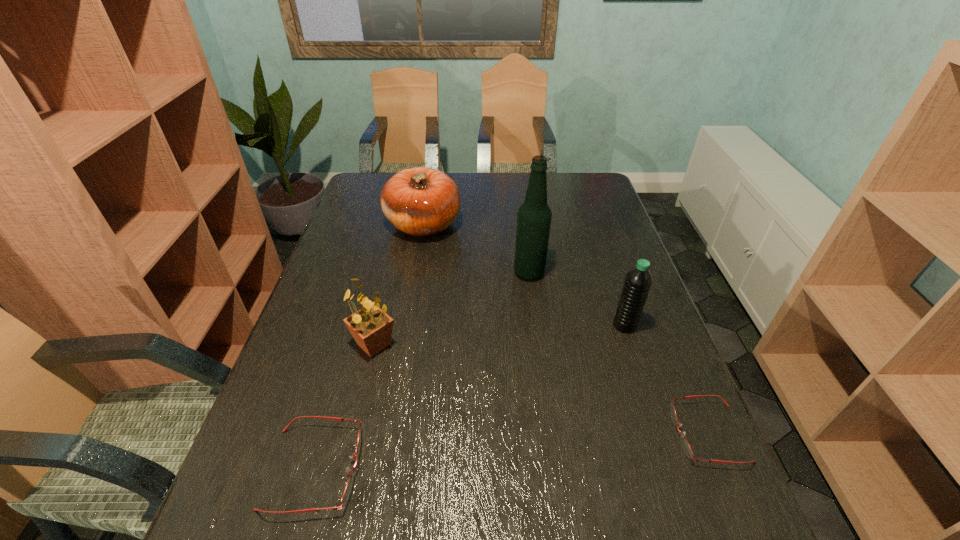
This screenshot has width=960, height=540. Find the location of `free location located 0.380m on the lenses of the right spectacles`. free location located 0.380m on the lenses of the right spectacles is located at coordinates (490, 434).

At what (x,y) coordinates should I click in order to perform the action: click on vacant point located 0.350m on the lenses of the right spectacles. Please return your answer as a coordinate pair (x, y). This screenshot has height=540, width=960. Looking at the image, I should click on (505, 434).

Where is `free space located 0.100m on the lenses of the right spectacles`? Image resolution: width=960 pixels, height=540 pixels. free space located 0.100m on the lenses of the right spectacles is located at coordinates (626, 434).

Locate an element on the screen. The height and width of the screenshot is (540, 960). free region located 0.190m on the back of the farthest object is located at coordinates (431, 178).

Locate an element on the screen. The width and height of the screenshot is (960, 540). free space located at the front of the sunflower with flowers visible is located at coordinates (x=356, y=421).

In order to click on free space located on the front of the water bottle in this screenshot , I will do `click(633, 349)`.

The height and width of the screenshot is (540, 960). Identify the location of free region located 0.080m on the front of the tallest object. pos(533,303).

Where is `object present at the far edge`? object present at the far edge is located at coordinates (420, 201).

This screenshot has height=540, width=960. I want to click on spectacles that is at the left edge, so click(x=347, y=490).

In order to click on pumpkin that is at the left edge in this screenshot , I will do `click(420, 201)`.